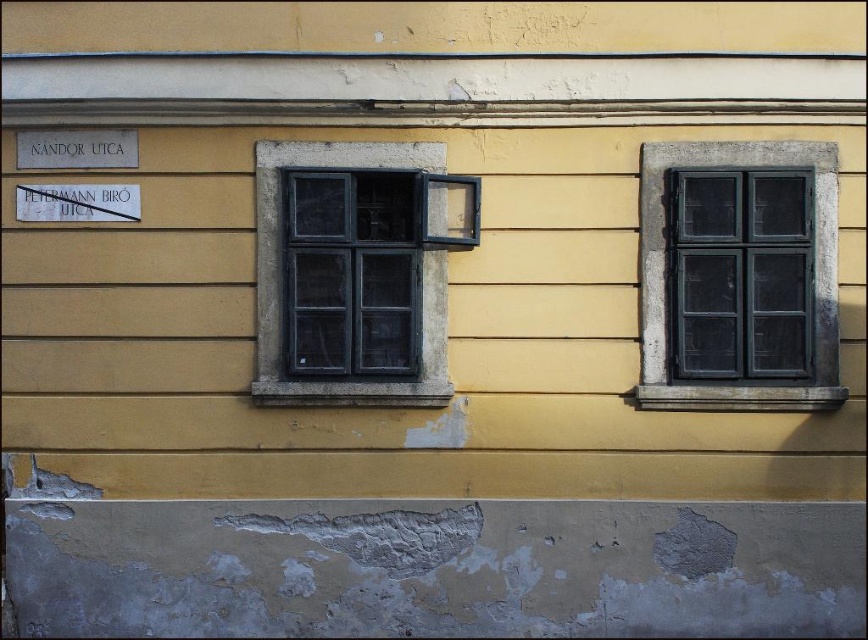
Question: Which point is closer to the camera?

Choices:
 (A) matte black window at upper right
 (B) matte black window at center

Answer: (B)

Question: Does matte black window at upper right have a greater width compared to matte black window at center?

Choices:
 (A) yes
 (B) no

Answer: (A)

Question: Is matte black window at upper right to the left of matte black window at center from the viewer's perspective?

Choices:
 (A) yes
 (B) no

Answer: (B)

Question: Is matte black window at upper right in front of matte black window at center?

Choices:
 (A) yes
 (B) no

Answer: (B)

Question: Which of the following is the farthest from the observer?

Choices:
 (A) (299, 262)
 (B) (799, 285)

Answer: (A)